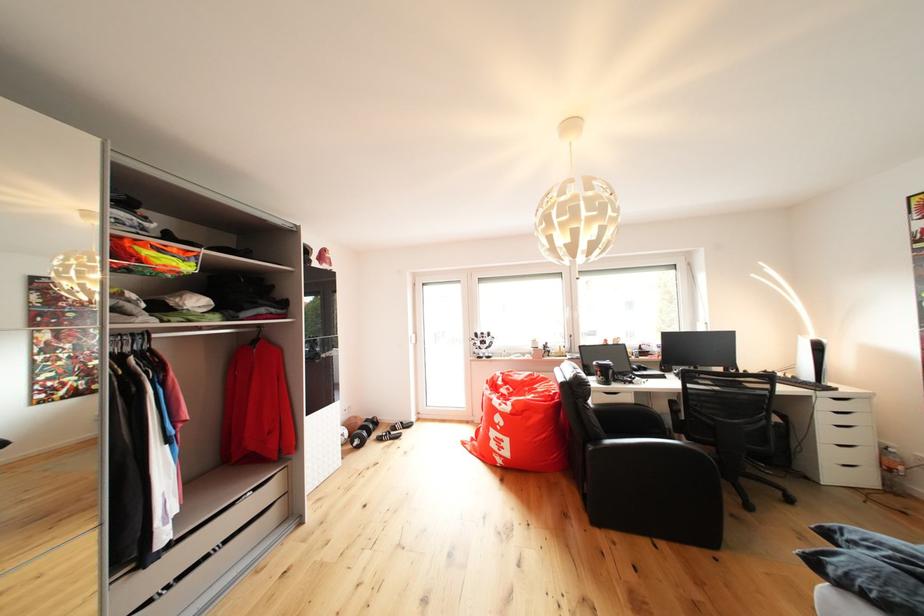
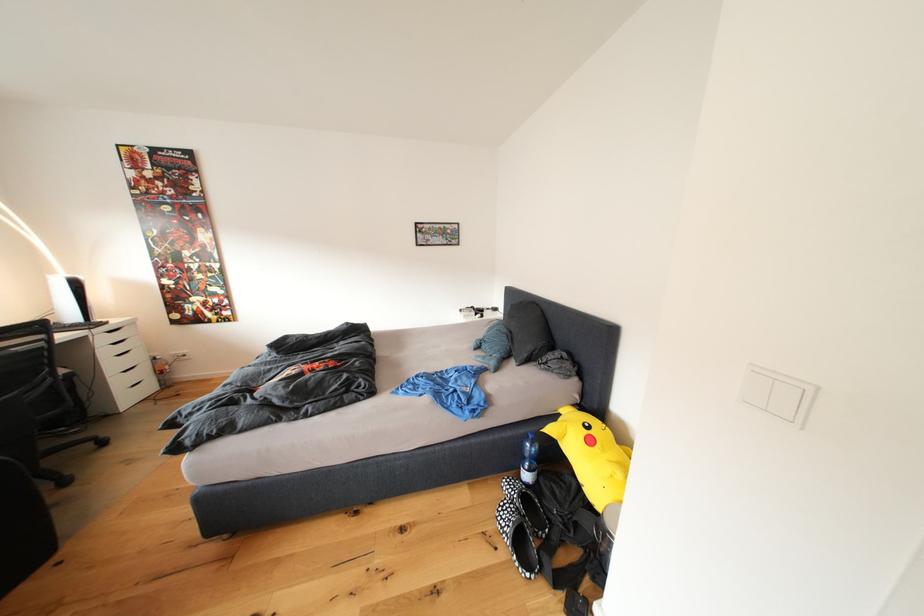
Find the pixel in the second image that matches point (855, 395) in the first image.

(125, 326)